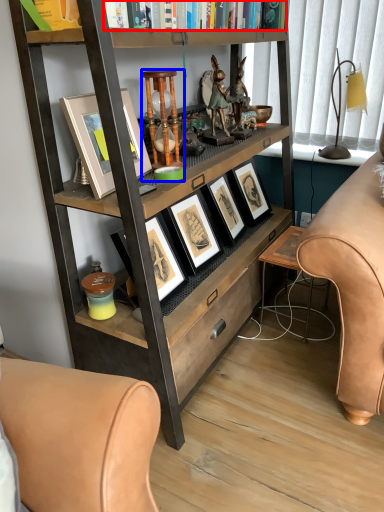
Question: Which object appears closest to the camera in this image, book (highlighted by a red box) or bar stool (highlighted by a blue box)?

Choices:
 (A) book
 (B) bar stool

Answer: (A)